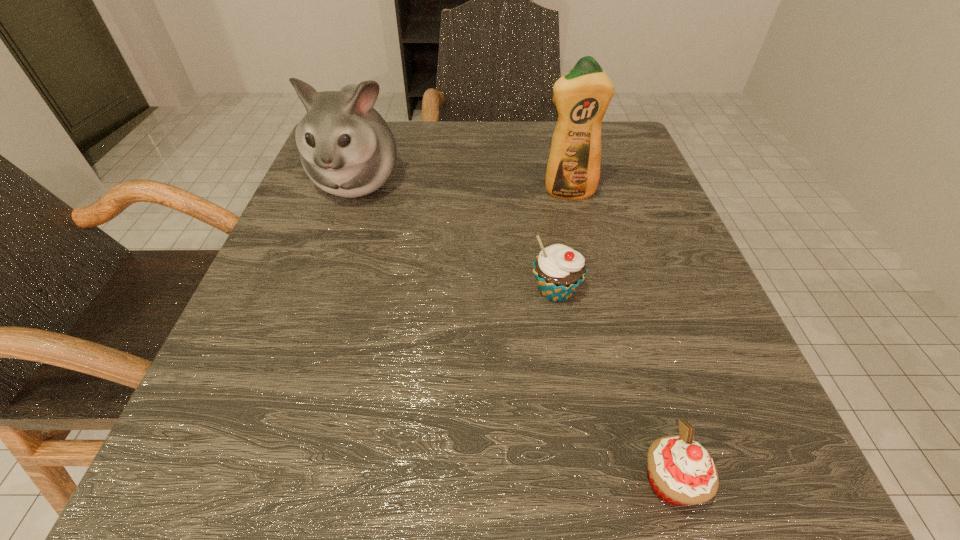
Where is `vacant position in the image that satisfies the following two spatial constraints: 1. on the face of the right cupcake; 2. on the right side of the hamster`? Image resolution: width=960 pixels, height=540 pixels. vacant position in the image that satisfies the following two spatial constraints: 1. on the face of the right cupcake; 2. on the right side of the hamster is located at coordinates (254, 482).

The image size is (960, 540). What are the coordinates of `free point that satisfies the following two spatial constraints: 1. on the face of the hamster; 2. on the left side of the nearer cupcake` in the screenshot? It's located at (254, 482).